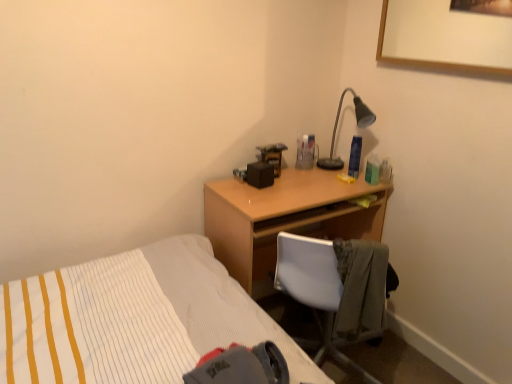
In order to face light brown wood desk at center, should I rotate leftwards or rightwards?

Turn right approximately 5.134 degrees to face it.

Where is `light brown wood desk at center`? light brown wood desk at center is located at coordinates (284, 218).

Would you say matte black desk lamp at upper right is to the left or to the right of white plastic chair at center in the picture?

Based on their positions, matte black desk lamp at upper right is located to the right of white plastic chair at center.

Is matte black desk lamp at upper right wider or thinner than white plastic chair at center?

In the image, matte black desk lamp at upper right appears to be more narrow than white plastic chair at center.

How many degrees apart are the facing directions of matte black desk lamp at upper right and white plastic chair at center?

150 degrees.

In the scene shown: Is matte black desk lamp at upper right facing away from white plastic chair at center?

No, matte black desk lamp at upper right is not facing the opposite direction of white plastic chair at center.

Could you tell me if white plastic chair at center is turned towards light brown wood desk at center?

Yes, white plastic chair at center is aimed at light brown wood desk at center.

Can we say white plastic chair at center lies outside light brown wood desk at center?

Indeed, white plastic chair at center is completely outside light brown wood desk at center.

Which object is wider, white plastic chair at center or light brown wood desk at center?

Wider between the two is white plastic chair at center.

Is matte black desk lamp at upper right not close to light brown wood desk at center?

No.

From a real-world perspective, is matte black desk lamp at upper right under light brown wood desk at center?

Actually, matte black desk lamp at upper right is physically above light brown wood desk at center in the real world.

Is matte black desk lamp at upper right located outside light brown wood desk at center?

That's correct, matte black desk lamp at upper right is outside of light brown wood desk at center.

Where is `desk that appears in front of the matte black desk lamp at upper right`? Image resolution: width=512 pixels, height=384 pixels. desk that appears in front of the matte black desk lamp at upper right is located at coordinates (284, 218).

Is there a large distance between light brown wood desk at center and white plastic chair at center?

light brown wood desk at center is near white plastic chair at center, not far away.

How far apart are light brown wood desk at center and white plastic chair at center?

light brown wood desk at center is 12.95 inches from white plastic chair at center.

Which is more to the left, light brown wood desk at center or white plastic chair at center?

light brown wood desk at center.

Is white plastic chair at center at the back of light brown wood desk at center?

Yes, light brown wood desk at center is facing away from white plastic chair at center.

From a real-world perspective, which object stands above the other?

matte black desk lamp at upper right is physically above.

Which object is closer to the camera taking this photo, light brown wood desk at center or matte black desk lamp at upper right?

light brown wood desk at center.

Looking at this image, is light brown wood desk at center oriented towards matte black desk lamp at upper right?

No, light brown wood desk at center is not aimed at matte black desk lamp at upper right.

Considering the relative sizes of light brown wood desk at center and matte black desk lamp at upper right in the image provided, is light brown wood desk at center shorter than matte black desk lamp at upper right?

Incorrect, the height of light brown wood desk at center does not fall short of that of matte black desk lamp at upper right.

Does white plastic chair at center contain matte black desk lamp at upper right?

Definitely not — matte black desk lamp at upper right is not inside white plastic chair at center.

From a real-world perspective, is white plastic chair at center over matte black desk lamp at upper right?

No.

Which of these two, white plastic chair at center or matte black desk lamp at upper right, is thinner?

matte black desk lamp at upper right is thinner.

Is point (294, 290) less distant than point (338, 163)?

Yes, point (294, 290) is closer to viewer.

Identify the location of chair that appears on the left of matte black desk lamp at upper right. (314, 290).

Find the location of a particular element. desk behind the white plastic chair at center is located at coordinates (284, 218).

Based on their spatial positions, is light brown wood desk at center or white plastic chair at center further from matte black desk lamp at upper right?

Among the two, white plastic chair at center is located further to matte black desk lamp at upper right.

Based on their spatial positions, is matte black desk lamp at upper right or light brown wood desk at center closer to white plastic chair at center?

light brown wood desk at center.

Estimate the real-world distances between objects in this image. Which object is further from white plastic chair at center, light brown wood desk at center or matte black desk lamp at upper right?

Based on the image, matte black desk lamp at upper right appears to be further to white plastic chair at center.

Based on their spatial positions, is white plastic chair at center or light brown wood desk at center further from matte black desk lamp at upper right?

white plastic chair at center is further to matte black desk lamp at upper right.

Which object lies further to the anchor point light brown wood desk at center, white plastic chair at center or matte black desk lamp at upper right?

Based on the image, matte black desk lamp at upper right appears to be further to light brown wood desk at center.

In the scene shown: Considering their positions, is matte black desk lamp at upper right positioned further to light brown wood desk at center than white plastic chair at center?

matte black desk lamp at upper right.

Image resolution: width=512 pixels, height=384 pixels. I want to click on desk between matte black desk lamp at upper right and white plastic chair at center vertically, so click(284, 218).